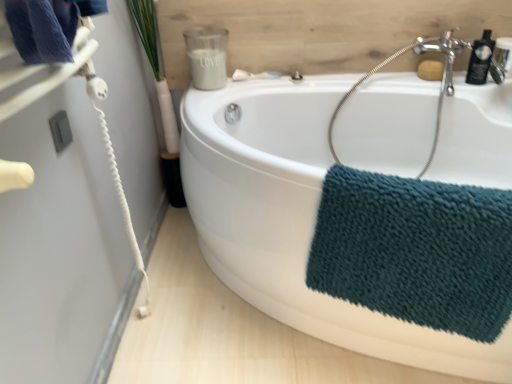
Question: Considering the positions of point pyautogui.click(x=453, y=92) and point pyautogui.click(x=481, y=51), is point pyautogui.click(x=453, y=92) closer or farther from the camera than point pyautogui.click(x=481, y=51)?

Choices:
 (A) farther
 (B) closer

Answer: (A)

Question: Looking at their shapes, would you say satin nickel faucet at upper right is wider or thinner than black glossy bottle at upper right, which appears as the second toiletry when viewed from the left?

Choices:
 (A) wide
 (B) thin

Answer: (A)

Question: Based on their relative distances, which object is farther from the teal textured towel at lower right?

Choices:
 (A) satin silver jar at upper center, marked as the 1th toiletry in a left-to-right arrangement
 (B) green leafy plant at upper left
 (C) satin nickel faucet at upper right
 (D) satin nickel faucet at upper right
 (E) white glossy bathtub at center

Answer: (B)

Question: Estimate the real-world distances between objects in this image. Which object is farther from the satin nickel faucet at upper right?

Choices:
 (A) black glossy bottle at upper right, the 1th toiletry when ordered from right to left
 (B) white glossy bathtub at center
 (C) satin silver jar at upper center, marked as the 1th toiletry in a left-to-right arrangement
 (D) satin nickel faucet at upper right
 (E) green leafy plant at upper left

Answer: (E)